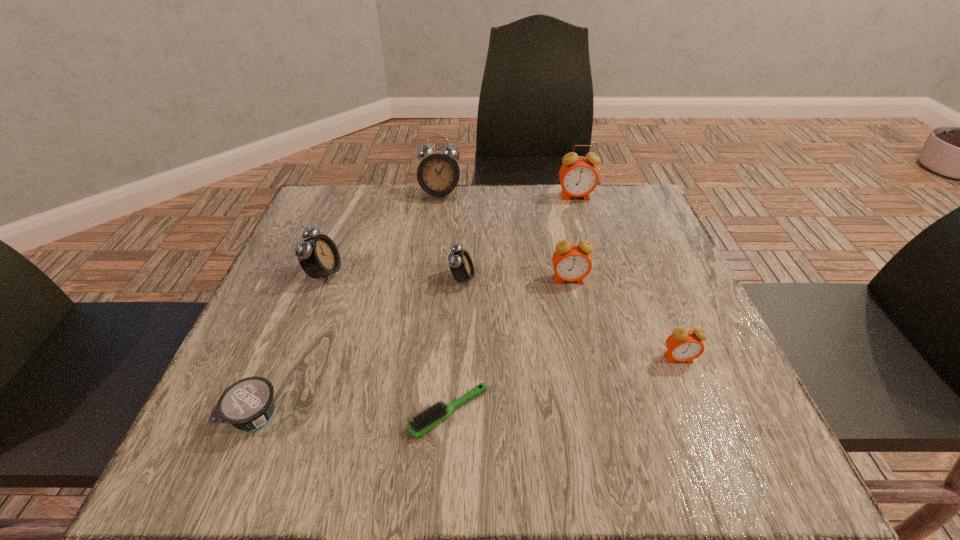
At what (x,y) coordinates should I click in order to perform the action: click on the biggest white alarm clock. Please return your answer as a coordinate pair (x, y). Looking at the image, I should click on (438, 174).

I want to click on the farthest pink alarm clock, so click(x=578, y=176).

Locate an element on the screen. the second biggest white alarm clock is located at coordinates (318, 256).

Locate an element on the screen. the leftmost alarm clock is located at coordinates (318, 256).

Where is `the second farthest pink alarm clock`? This screenshot has height=540, width=960. the second farthest pink alarm clock is located at coordinates (571, 261).

Find the location of `the smallest white alarm clock`. the smallest white alarm clock is located at coordinates (x=460, y=263).

You are a GUI agent. You are given a task and a screenshot of the screen. Output one action in this format:
    pyautogui.click(x=<x>, y=<y>)
    Task: Click on the rightmost object
    
    Given the screenshot: What is the action you would take?
    pyautogui.click(x=683, y=345)

Where is `the nearest alarm clock`? The image size is (960, 540). the nearest alarm clock is located at coordinates (683, 345).

Locate an element on the screen. This screenshot has height=540, width=960. yogurt is located at coordinates (248, 404).

Locate an element on the screen. hairbrush is located at coordinates (426, 420).